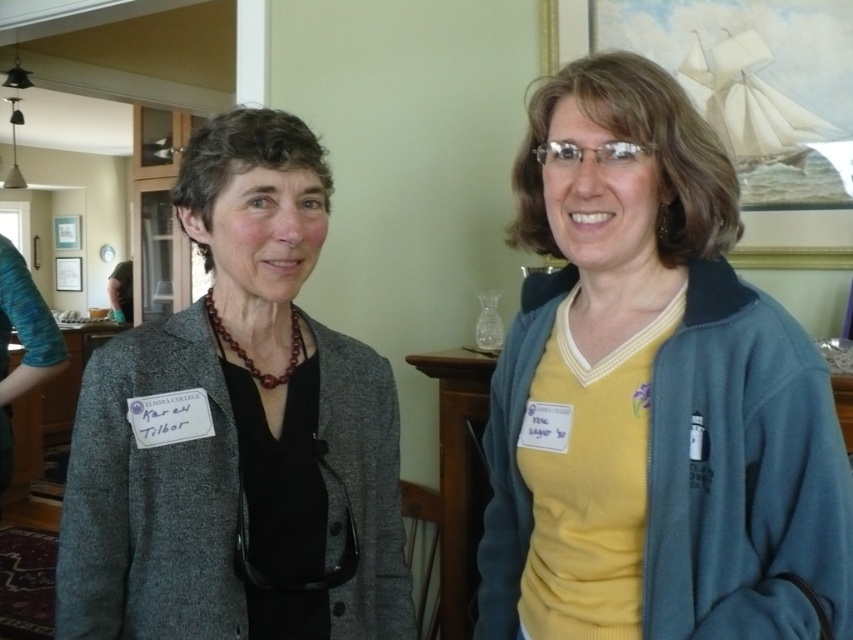
Based on the photo, you are organizing a coat check for an event and need to determine which coat to place in a standard coat hanger. The yellow fleece jacket at right and the matte gray blazer at center are both available. Based on their sizes, which one is more suitable for the hanger?

The matte gray blazer at center is more suitable for the standard coat hanger since it is smaller in size compared to the yellow fleece jacket at right, which is larger and might require a different hanger type.

You are organizing a coat rack for guests at an event. You have a yellow fleece jacket at right and a matte gray blazer at center. Which item will require more horizontal space when hanging?

The matte gray blazer at center requires more horizontal space when hanging because it has a greater width than the yellow fleece jacket at right.